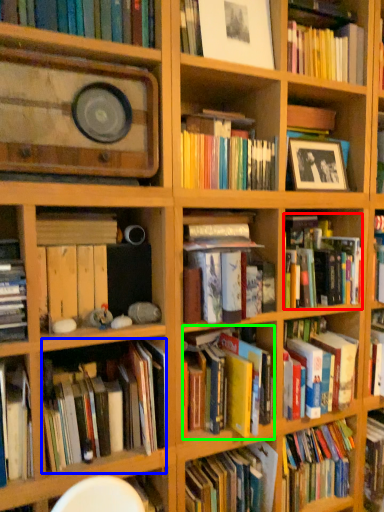
Question: Estimate the real-world distances between objects in this image. Which object is farther from book (highlighted by a red box), book (highlighted by a blue box) or book (highlighted by a green box)?

Choices:
 (A) book
 (B) book

Answer: (A)